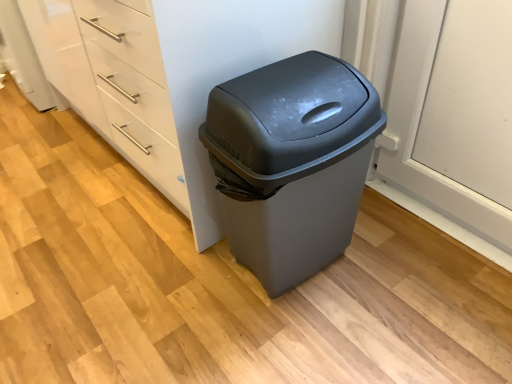
Identify the location of free point in front of white glossy dresser at center. (161, 283).